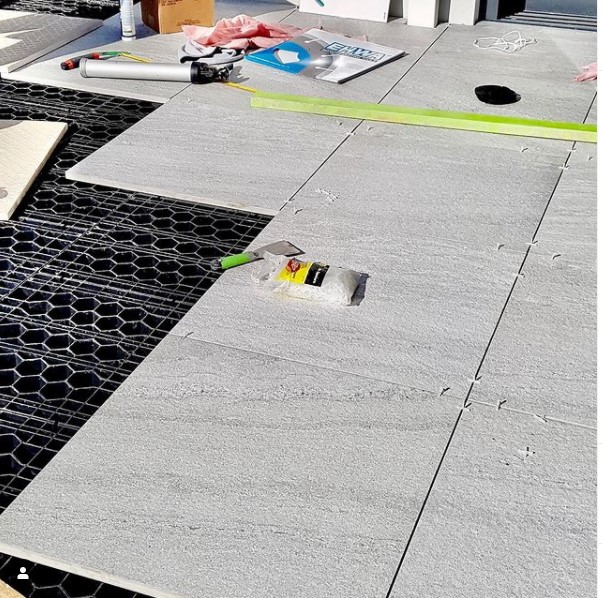
The height and width of the screenshot is (598, 603). What are the coordinates of `floor` in the screenshot? It's located at (461, 251).